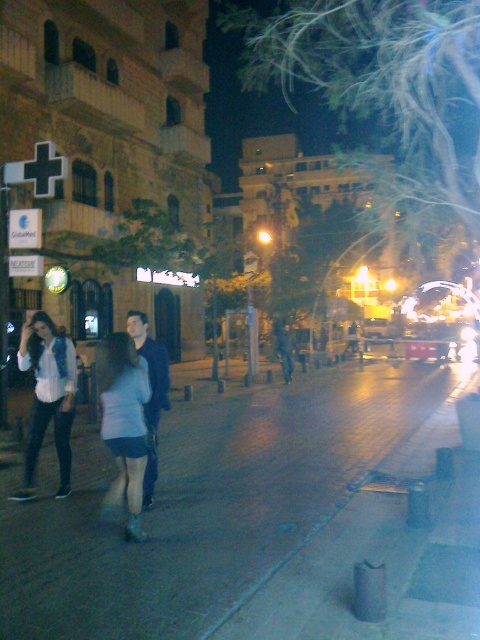
Who is positioned more to the right, smooth concrete sidewalk at lower center or denim jacket at left?

smooth concrete sidewalk at lower center

Describe the element at coordinates (207, 502) in the screenshot. I see `smooth concrete sidewalk at lower center` at that location.

I want to click on smooth concrete sidewalk at lower center, so pyautogui.click(x=207, y=502).

Between light blue denim shorts at center and denim jacket at left, which one appears on the left side from the viewer's perspective?

Positioned to the left is denim jacket at left.

Between point (133, 442) and point (54, 330), which one is positioned behind?

The point (54, 330) is behind.

What are the coordinates of `light blue denim shorts at center` in the screenshot? It's located at pos(123,422).

Is smooth concrete sidewalk at lower center thinner than light blue denim shorts at center?

In fact, smooth concrete sidewalk at lower center might be wider than light blue denim shorts at center.

Identify the location of smooth concrete sidewalk at lower center. The image size is (480, 640). (207, 502).